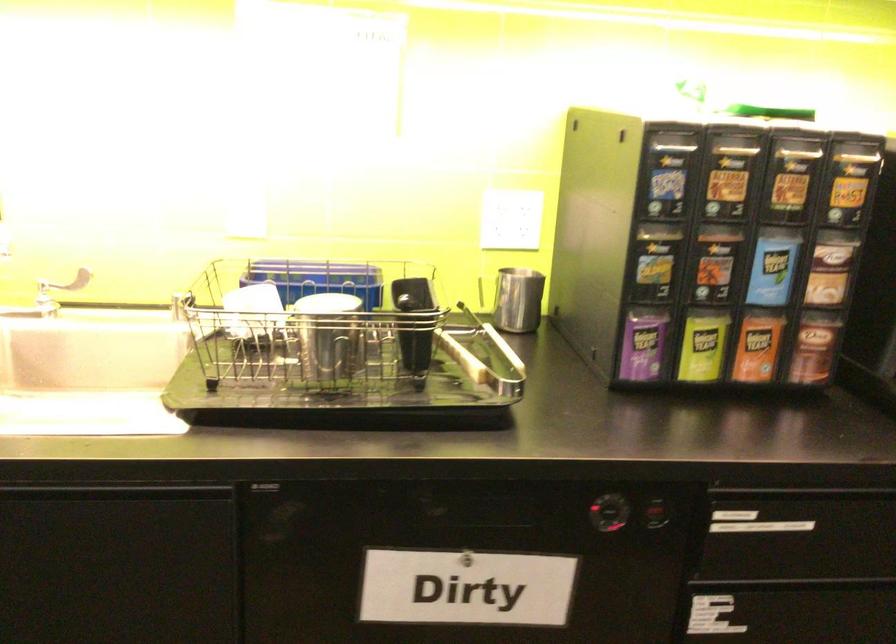
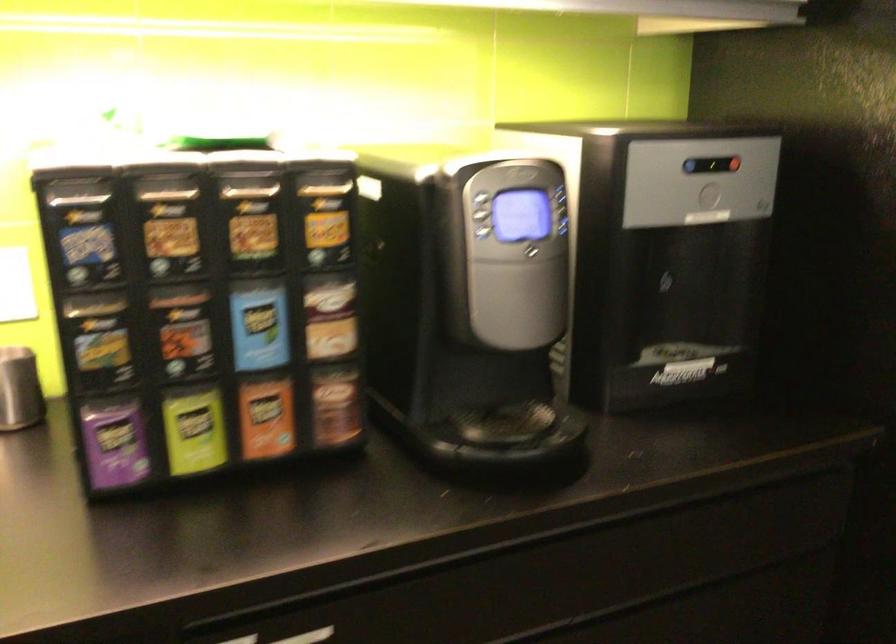
Find the pixel in the second image that matches point (641, 345) in the first image.

(114, 442)